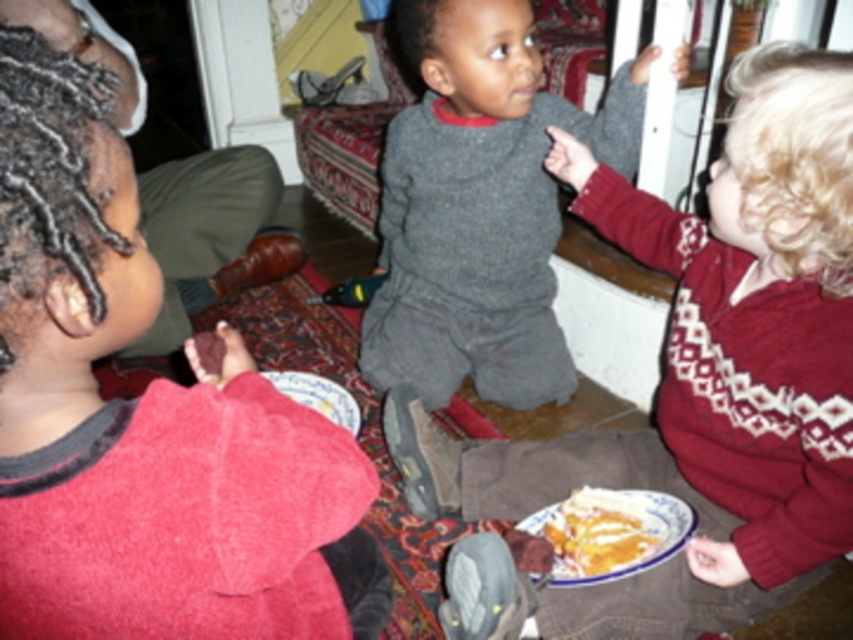
Question: Is red fleece sweater at left bigger than matte red sweater at left?

Choices:
 (A) no
 (B) yes

Answer: (A)

Question: Which point is farther to the camera?

Choices:
 (A) gray wool sweater at center
 (B) gray sweater at center
 (C) matte red sweater at left

Answer: (C)

Question: Which of these objects is positioned farthest from the red fleece sweater at left?

Choices:
 (A) gray wool sweater at center
 (B) yellowish matte pie at lower center

Answer: (A)

Question: Is gray sweater at center above white ceramic plate at lower center?

Choices:
 (A) yes
 (B) no

Answer: (A)

Question: Among these objects, which one is farthest from the camera?

Choices:
 (A) white ceramic plate at lower center
 (B) gray sweater at center
 (C) gray wool sweater at center

Answer: (C)

Question: Is red fleece sweater at left to the left of yellowish matte pie at lower center from the viewer's perspective?

Choices:
 (A) no
 (B) yes

Answer: (B)